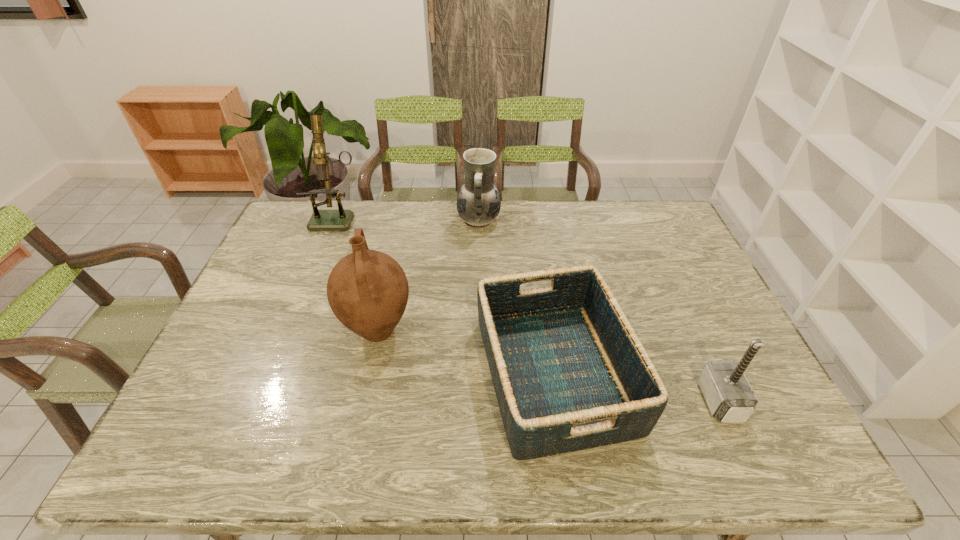
This screenshot has height=540, width=960. Identify the location of object situated at the far left corner. (341, 219).

Find the location of a particular element. blank space at the far edge of the desktop is located at coordinates point(528,225).

In the image, there is a desktop. What are the coordinates of `free space at the near edge` in the screenshot? It's located at (560, 457).

Identify the location of vacant space at the left edge. The image size is (960, 540). (202, 376).

In the image, there is a desktop. Where is `vacant space at the right edge`? The image size is (960, 540). vacant space at the right edge is located at coordinates (696, 373).

Where is `vacant space at the far right corner`? vacant space at the far right corner is located at coordinates (636, 210).

Identify the location of empty space that is in between the leftmost object and the right pitcher. The height and width of the screenshot is (540, 960). (409, 219).

At what (x,y) coordinates should I click in order to perform the action: click on blank region between the right pitcher and the left pitcher. Please return your answer as a coordinate pair (x, y). Looking at the image, I should click on (428, 276).

You are a GUI agent. You are given a task and a screenshot of the screen. Output one action in this format:
    pyautogui.click(x=<x>, y=<y>)
    Task: Click on the free spot between the left pitcher and the shortest object
    Image resolution: width=960 pixels, height=540 pixels.
    Given the screenshot: What is the action you would take?
    pyautogui.click(x=467, y=352)

In order to click on vacant area that lies between the shorter pitcher and the microscope in this screenshot , I will do `click(409, 219)`.